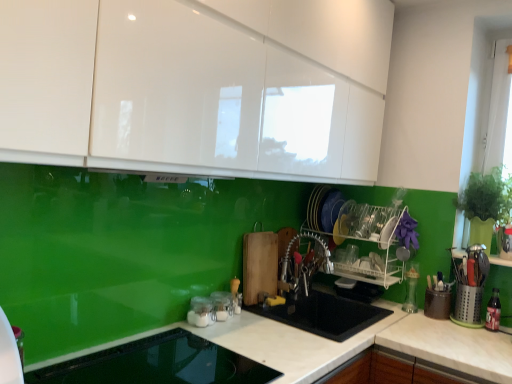
Locate an element on the screen. This screenshot has width=512, height=384. free point above white glossy countertop at center (from a real-world perspective) is located at coordinates (248, 341).